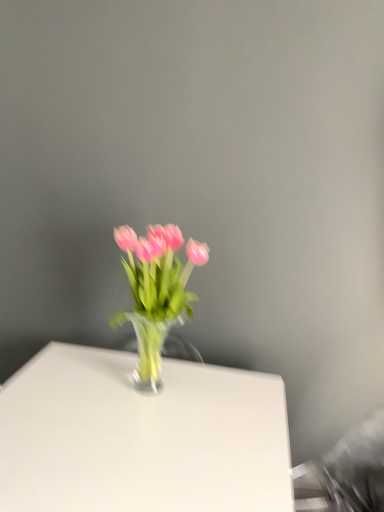
The width and height of the screenshot is (384, 512). What are the coordinates of `vacant area that lies to the right of pink glass vase at center` in the screenshot? It's located at (232, 399).